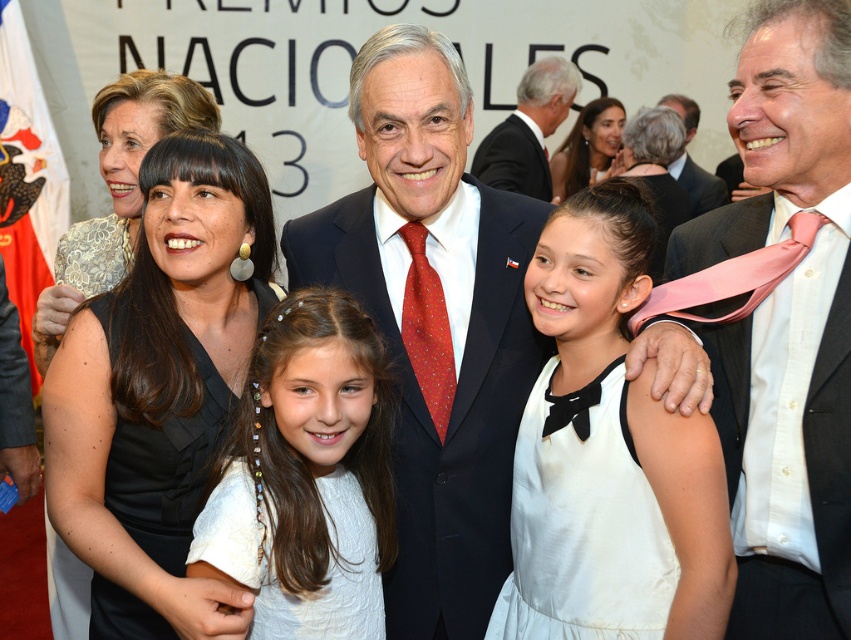
Between black matte dress at center and dark suit at center, which one is positioned lower?

black matte dress at center is lower down.

Is point (156, 195) positioned before point (529, 104)?

Yes, point (156, 195) is closer to viewer.

The height and width of the screenshot is (640, 851). What are the coordinates of `black matte dress at center` in the screenshot? It's located at (158, 385).

Which of these two, dark suit at center or pink silk tie at upper right, stands shorter?

pink silk tie at upper right is shorter.

Does dark suit at center have a smaller size compared to pink silk tie at upper right?

No, dark suit at center is not smaller than pink silk tie at upper right.

This screenshot has height=640, width=851. Find the location of `dark suit at center`. dark suit at center is located at coordinates pos(528,131).

Between dark suit at center and red silk tie at center, which one has less height?

red silk tie at center is shorter.

Does dark suit at center have a lesser width compared to red silk tie at center?

In fact, dark suit at center might be wider than red silk tie at center.

What are the coordinates of `dark suit at center` in the screenshot? It's located at (528, 131).

Where is `dark suit at center`? Image resolution: width=851 pixels, height=640 pixels. dark suit at center is located at coordinates (528, 131).